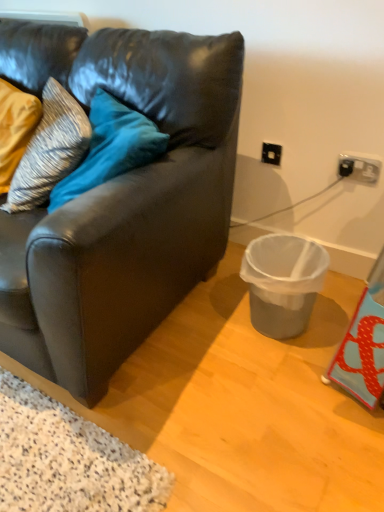
Find the location of a particular element. vacant space situated on the left part of gray plastic trash can at lower right is located at coordinates (215, 329).